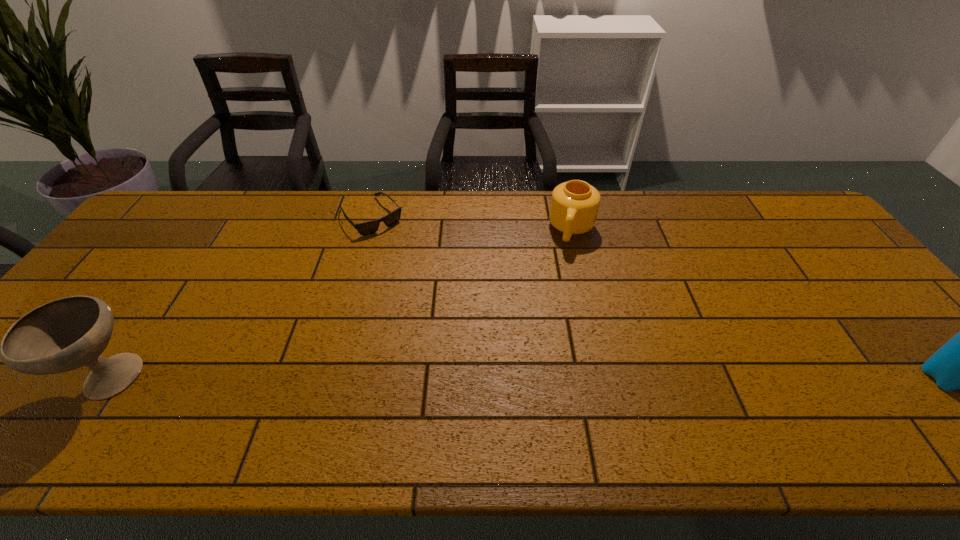
Where is `the second tallest object`? the second tallest object is located at coordinates (65, 334).

Identify the location of chalice. (65, 334).

Image resolution: width=960 pixels, height=540 pixels. Find the location of `sunglasses`. sunglasses is located at coordinates (366, 228).

Find the location of a particular element. The width and height of the screenshot is (960, 540). the second object from left to right is located at coordinates (366, 228).

Find the location of a particular element. The image size is (960, 540). mug is located at coordinates (574, 207).

This screenshot has width=960, height=540. In order to click on the third tallest object in this screenshot , I will do `click(574, 207)`.

You are a GUI agent. You are given a task and a screenshot of the screen. Output one action in this format:
    pyautogui.click(x=<x>, y=<y>)
    Task: Click on the blank space located 0.350m on the right of the leftmost object
    The image size is (960, 540).
    Given the screenshot: What is the action you would take?
    pyautogui.click(x=302, y=381)

The width and height of the screenshot is (960, 540). Identify the location of vacant space situated 0.130m on the front-facing side of the sunglasses. (406, 256).

Locate an element on the screen. The width and height of the screenshot is (960, 540). free space located on the front-facing side of the sunglasses is located at coordinates (440, 295).

The height and width of the screenshot is (540, 960). Find the location of `vacant space situated on the front-facing side of the sunglasses`. vacant space situated on the front-facing side of the sunglasses is located at coordinates (438, 293).